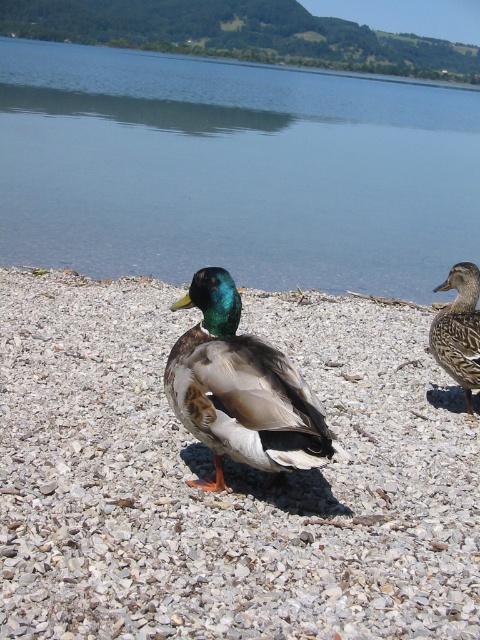
Who is shorter, transparent water at center or shiny green and brown duck at center?

shiny green and brown duck at center is shorter.

Can you confirm if transparent water at center is thinner than shiny green and brown duck at center?

A: No.

Who is more forward, (336,74) or (323,440)?

Point (323,440)

What are the coordinates of `transparent water at center` in the screenshot? It's located at (233, 170).

Between transparent water at center and green glossy duck at right, which one appears on the right side from the viewer's perspective?

green glossy duck at right

Who is more forward, (117, 176) or (475, 280)?

Point (475, 280) is in front.

Is point (352, 100) farther from camera compared to point (457, 300)?

Yes, point (352, 100) is behind point (457, 300).

I want to click on transparent water at center, so click(x=233, y=170).

Who is positioned more to the right, shiny green and brown duck at center or green glossy duck at right?

Positioned to the right is green glossy duck at right.

Which is below, shiny green and brown duck at center or green glossy duck at right?

Positioned lower is shiny green and brown duck at center.

The width and height of the screenshot is (480, 640). Find the location of `shiny green and brown duck at center`. shiny green and brown duck at center is located at coordinates (240, 388).

At what (x,y) coordinates should I click in order to perform the action: click on shiny green and brown duck at center. Please return your answer as a coordinate pair (x, y). This screenshot has height=640, width=480. Looking at the image, I should click on (240, 388).